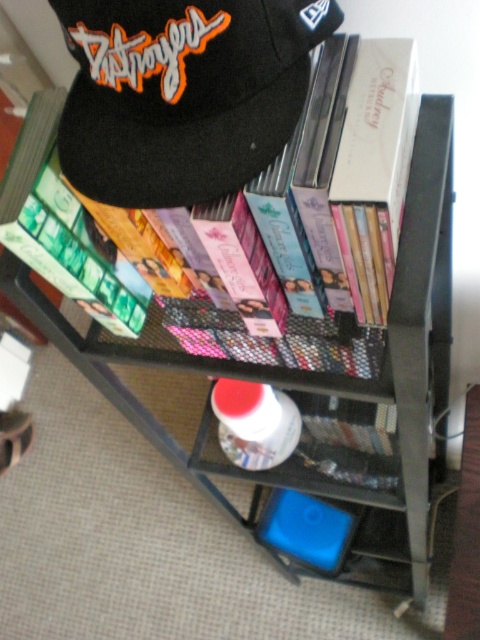
In the scene shown: You are organizing the items on the metal shelving unit and notice the black felt cap at upper left. Where exactly is it positioned on the shelf?

The black felt cap at upper left is located at point (x=182, y=93).

You are organizing the items on the metal shelving unit and need to place a new item between the black felt cap at upper left and the white glossy bottle at center. Can you fit it there?

The black felt cap at upper left is above the white glossy bottle at center, so there is vertical space between them. However, since they are positioned vertically, placing an item between them horizontally might not be possible unless there is horizontal space available. The description does not provide information about horizontal spacing, so it is uncertain if the new item can fit there.

You are organizing items on a metal shelving unit. You need to place a new item between the black felt cap at upper left and the white glossy bottle at center. The new item is 16 inches long. Will it fit between them?

The distance between the black felt cap at upper left and the white glossy bottle at center is 15.91 inches. Since the new item is 16 inches long, it will not fit between them as it is slightly longer than the available space.